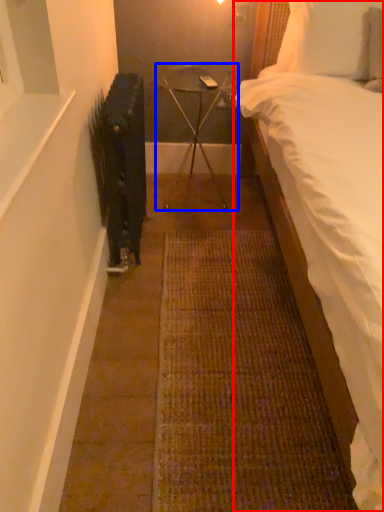
Question: Which of the following is the farthest to the observer, bed (highlighted by a red box) or furniture (highlighted by a blue box)?

Choices:
 (A) bed
 (B) furniture

Answer: (B)